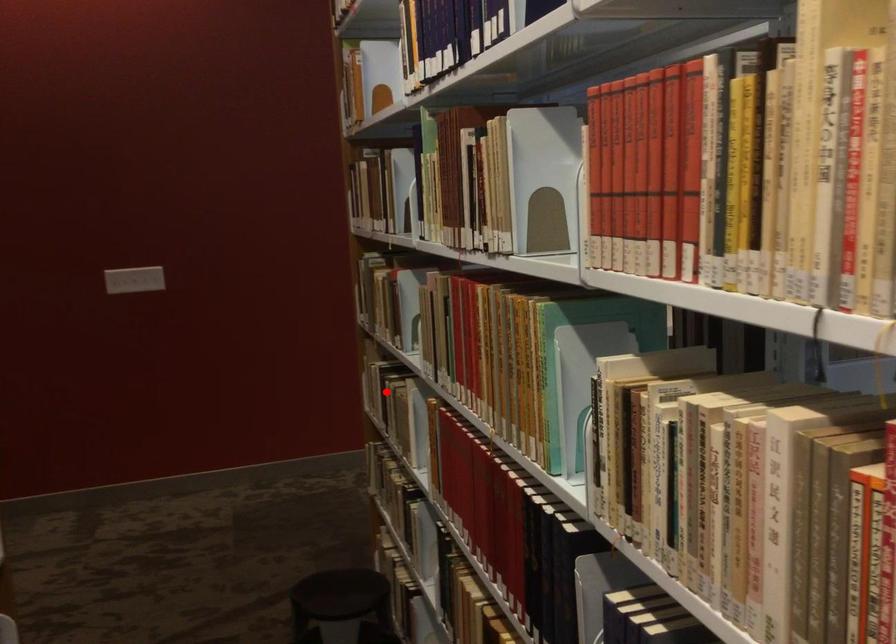
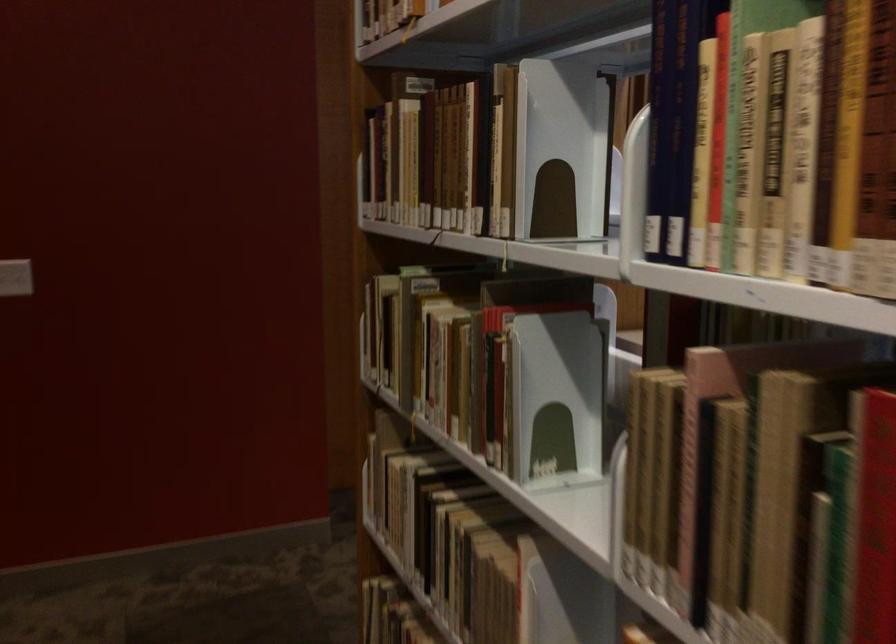
Where in the second image is the point corresponding to the highlighted location from the first image?

(445, 532)